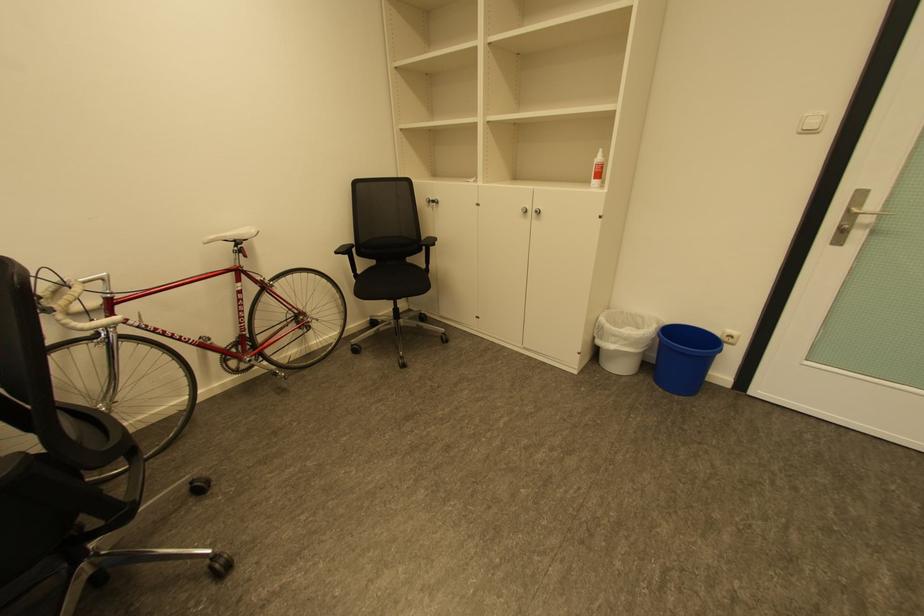
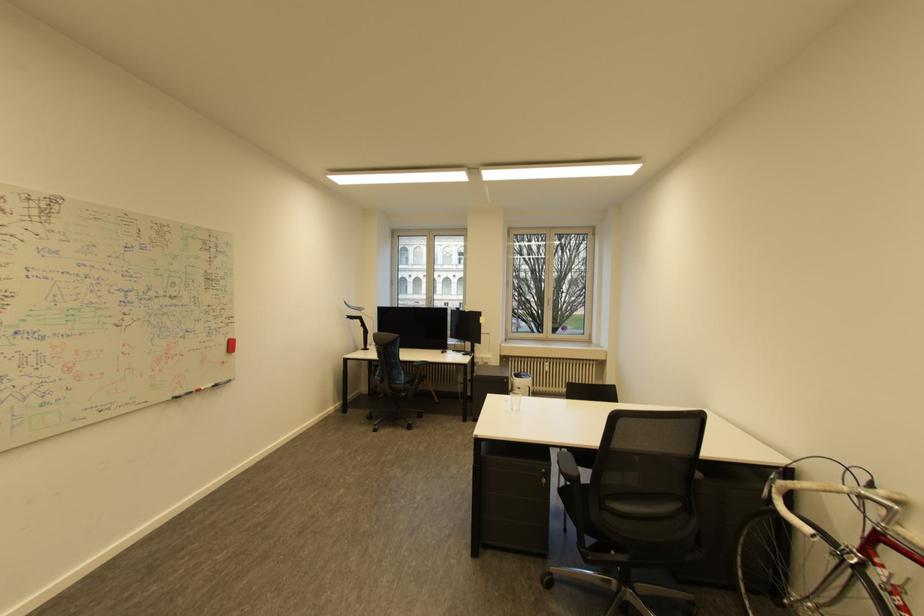
The point at (84, 281) is marked in the first image. Where is the corresponding point in the second image?

(869, 492)